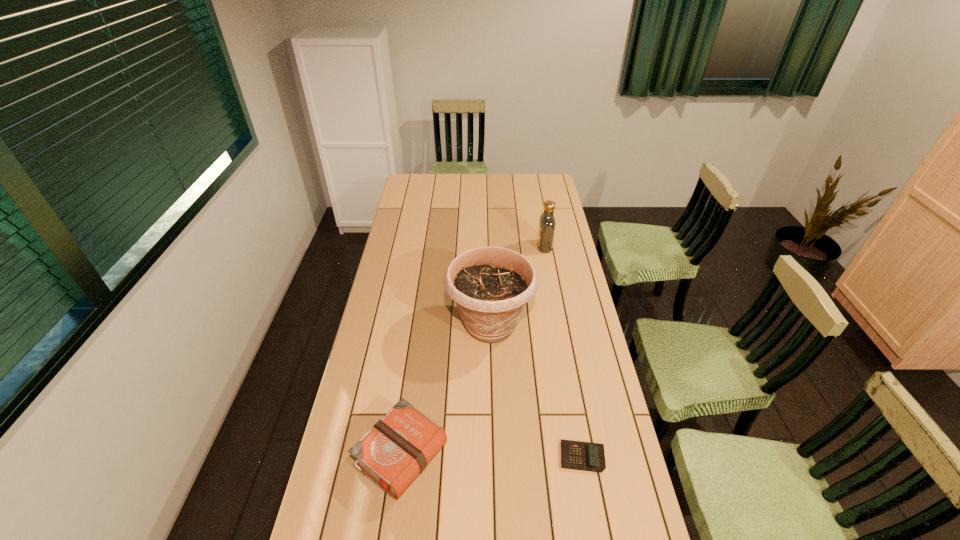
Where is `free spot between the flowerpot and the third tallest object`? The height and width of the screenshot is (540, 960). free spot between the flowerpot and the third tallest object is located at coordinates (445, 390).

Where is `free area in between the vodka and the calculator`? The image size is (960, 540). free area in between the vodka and the calculator is located at coordinates (564, 352).

Locate an element on the screen. free spot between the third nearest object and the third tallest object is located at coordinates (445, 390).

The height and width of the screenshot is (540, 960). What are the coordinates of `free space between the flowerpot and the calculator` in the screenshot? It's located at click(x=536, y=391).

At what (x,y) coordinates should I click in order to perform the action: click on free space that is in between the shortest object and the Bible. Please return your answer as a coordinate pair (x, y). The height and width of the screenshot is (540, 960). Looking at the image, I should click on (492, 456).

Where is `free space between the calculator and the third nearest object`? Image resolution: width=960 pixels, height=540 pixels. free space between the calculator and the third nearest object is located at coordinates (536, 391).

Identify the location of object that is the third closest to the flowerpot. Image resolution: width=960 pixels, height=540 pixels. (586, 456).

Where is `object that stands as the second closest to the flowerpot`? This screenshot has height=540, width=960. object that stands as the second closest to the flowerpot is located at coordinates (546, 230).

Find the location of a particular element. The image size is (960, 540). vacant space that satisfies the following two spatial constraints: 1. on the front side of the second farthest object; 2. on the right side of the calculator is located at coordinates (492, 457).

Identify the location of vacant point that satisfies the following two spatial constraints: 1. on the front-facing side of the farthest object; 2. on the front side of the third nearest object. The height and width of the screenshot is (540, 960). (559, 325).